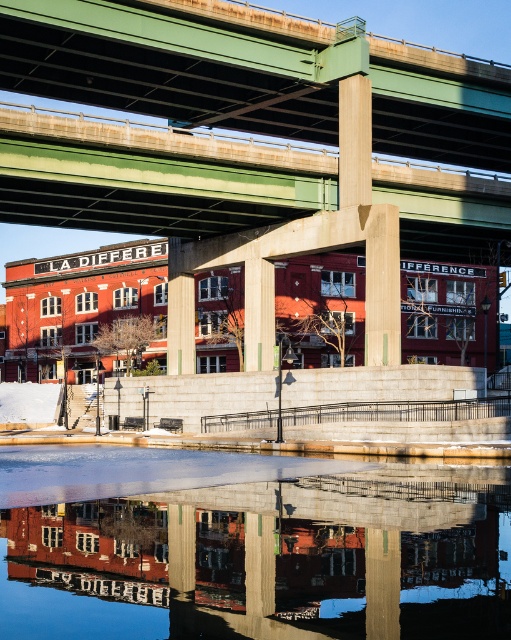
Is point (234, 568) farther from camera compared to point (39, 163)?

No, it is in front of (39, 163).

Does point (229, 577) come closer to viewer compared to point (503, 166)?

Yes, point (229, 577) is in front of point (503, 166).

The height and width of the screenshot is (640, 511). Identify the location of transparent glass water at center. (248, 547).